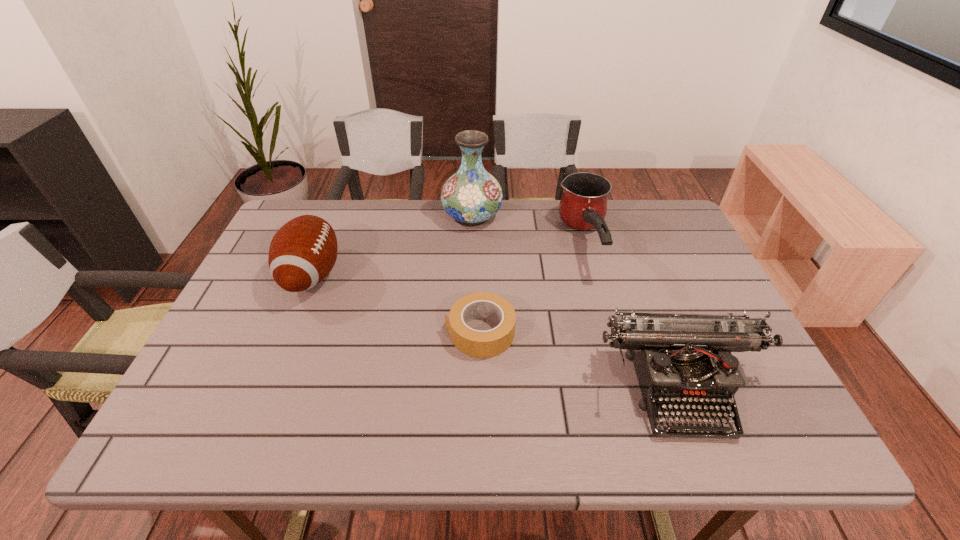
I want to click on free space located at the edge of the shortest object, so click(417, 332).

At what (x,y) coordinates should I click in order to perform the action: click on vase present at the far edge. Please return your answer as a coordinate pair (x, y). The width and height of the screenshot is (960, 540). Looking at the image, I should click on (471, 196).

Find the location of a particular element. football positioned at the far edge is located at coordinates (303, 251).

At what (x,y) coordinates should I click in order to perform the action: click on saucepan that is positioned at the far edge. Please return your answer as a coordinate pair (x, y). The image size is (960, 540). Looking at the image, I should click on (583, 206).

Locate an element on the screen. object present at the near edge is located at coordinates (682, 361).

Locate an element on the screen. object situated at the left edge is located at coordinates (303, 251).

The image size is (960, 540). I want to click on object located in the right edge section of the desktop, so click(682, 361).

Where is `object present at the far left corner`? The width and height of the screenshot is (960, 540). object present at the far left corner is located at coordinates (303, 251).

Where is `object present at the near right corner`? object present at the near right corner is located at coordinates (682, 361).

Identify the location of vacant space at the far edge of the desktop. Image resolution: width=960 pixels, height=540 pixels. (420, 243).